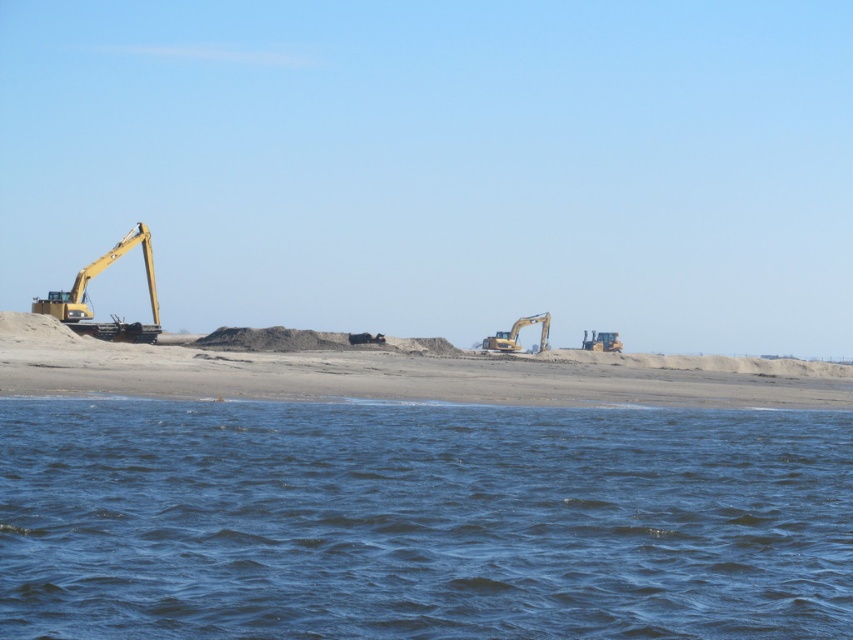
You are a construction worker planning to drive the yellow metallic excavator at center across the smooth sand beach at center. Given the beach width, will the excavator fit comfortably without risking getting stuck on either side?

The smooth sand beach at center is wider than the yellow metallic excavator at center, so the excavator will fit comfortably with space on both sides.

You are standing at the point with coordinates point (126,324) and want to walk to the point with coordinates point (595,362). Are there any obstacles between you and your destination?

Yes, the point (595,362) is behind point (126,324), so there might be obstacles blocking your path between you and your destination.